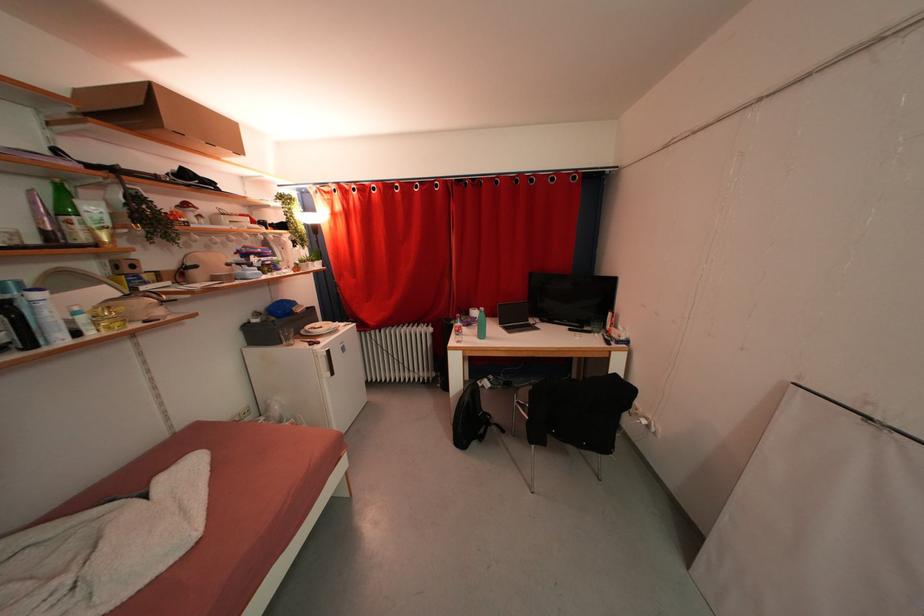
Image resolution: width=924 pixels, height=616 pixels. I want to click on chair sitting surface, so click(565, 400).